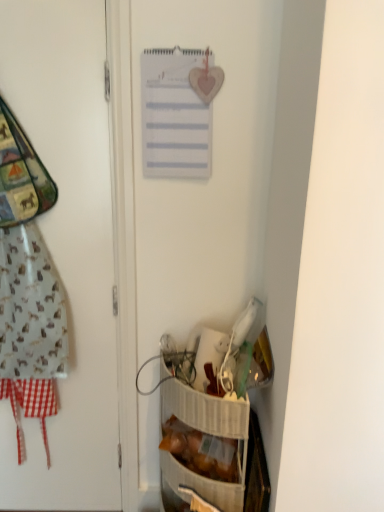
In order to face translucent plastic bag of bread at lower right, should I rotate leftwards or rightwards?

To face it directly, rotate right by 0.605 degrees.

Where is `white paper calendar at upper center`? The image size is (384, 512). white paper calendar at upper center is located at coordinates (174, 115).

This screenshot has height=512, width=384. What do you see at coordinates (67, 250) in the screenshot?
I see `white matte door at left` at bounding box center [67, 250].

The width and height of the screenshot is (384, 512). Identify the location of translucent plastic bag of bread at lower right. (201, 451).

Is translucent plastic bag of bread at lower right next to white paper calendar at upper center and touching it?

No.

Between point (194, 457) and point (167, 163), which one is positioned in front?

Positioned in front is point (167, 163).

Which is correct: translucent plastic bag of bread at lower right is inside white paper calendar at upper center, or outside of it?

translucent plastic bag of bread at lower right is spatially situated outside white paper calendar at upper center.

Based on the photo, from the image's perspective, between translucent plastic bag of bread at lower right and white paper calendar at upper center, who is located below?

translucent plastic bag of bread at lower right.

Measure the distance from white paper calendar at upper center to white matte door at left.

They are 14.80 inches apart.

Is white paper calendar at upper center positioned in front of white matte door at left?

No.

Between white paper calendar at upper center and white matte door at left, which one has smaller width?

With smaller width is white paper calendar at upper center.

Who is smaller, white paper calendar at upper center or white matte door at left?

white paper calendar at upper center is smaller.

Is white paper calendar at upper center further to the viewer compared to translucent plastic bag of bread at lower right?

No, white paper calendar at upper center is in front of translucent plastic bag of bread at lower right.

Would you say white paper calendar at upper center is inside or outside translucent plastic bag of bread at lower right?

white paper calendar at upper center cannot be found inside translucent plastic bag of bread at lower right.

From the image's perspective, does white paper calendar at upper center appear higher than translucent plastic bag of bread at lower right?

Yes.

Between white paper calendar at upper center and translucent plastic bag of bread at lower right, which one appears on the left side from the viewer's perspective?

From the viewer's perspective, white paper calendar at upper center appears more on the left side.

Are white matte door at left and white paper calendar at upper center located far from each other?

white matte door at left is near white paper calendar at upper center, not far away.

Is white matte door at left oriented towards white paper calendar at upper center?

No, white matte door at left is not turned towards white paper calendar at upper center.

Considering their positions, is white matte door at left located in front of or behind white paper calendar at upper center?

white matte door at left is positioned closer to the viewer than white paper calendar at upper center.

From the image's perspective, relative to translucent plastic bag of bread at lower right, is white matte door at left above or below?

Based on their image positions, white matte door at left is located above translucent plastic bag of bread at lower right.

In the image, is white matte door at left positioned in front of or behind translucent plastic bag of bread at lower right?

Clearly, white matte door at left is in front of translucent plastic bag of bread at lower right.

Is point (101, 256) closer or farther from the camera than point (208, 466)?

Point (101, 256).

From a real-world perspective, which object rests below the other?

From a 3D spatial view, translucent plastic bag of bread at lower right is below.

Considering the relative sizes of translucent plastic bag of bread at lower right and white matte door at left in the image provided, is translucent plastic bag of bread at lower right wider than white matte door at left?

Correct, the width of translucent plastic bag of bread at lower right exceeds that of white matte door at left.

At what (x,y) coordinates should I click in order to perform the action: click on door above the translucent plastic bag of bread at lower right (from the image's perspective). Please return your answer as a coordinate pair (x, y). The width and height of the screenshot is (384, 512). Looking at the image, I should click on (67, 250).

From the image's perspective, between translucent plastic bag of bread at lower right and white matte door at left, which one is located above?

From the image's view, white matte door at left is above.

This screenshot has width=384, height=512. I want to click on list above the translucent plastic bag of bread at lower right (from a real-world perspective), so tap(174, 115).

Identify the location of list to the right of white matte door at left. The height and width of the screenshot is (512, 384). (174, 115).

Looking at the image, which one is located further to translucent plastic bag of bread at lower right, white paper calendar at upper center or white matte door at left?

Among the two, white paper calendar at upper center is located further to translucent plastic bag of bread at lower right.

Estimate the real-world distances between objects in this image. Which object is further from white paper calendar at upper center, white matte door at left or translucent plastic bag of bread at lower right?

translucent plastic bag of bread at lower right is positioned further to the anchor white paper calendar at upper center.

Considering their positions, is white matte door at left positioned further to translucent plastic bag of bread at lower right than white paper calendar at upper center?

Based on the image, white paper calendar at upper center appears to be further to translucent plastic bag of bread at lower right.

Considering their positions, is translucent plastic bag of bread at lower right positioned closer to white paper calendar at upper center than white matte door at left?

white matte door at left.

Based on their spatial positions, is translucent plastic bag of bread at lower right or white paper calendar at upper center further from white matte door at left?

translucent plastic bag of bread at lower right lies further to white matte door at left than the other object.

Looking at this image, from the image, which object appears to be farther from white matte door at left, white paper calendar at upper center or translucent plastic bag of bread at lower right?

translucent plastic bag of bread at lower right is further to white matte door at left.

Locate an element on the screen. door that lies between white paper calendar at upper center and translucent plastic bag of bread at lower right from top to bottom is located at coordinates (67, 250).